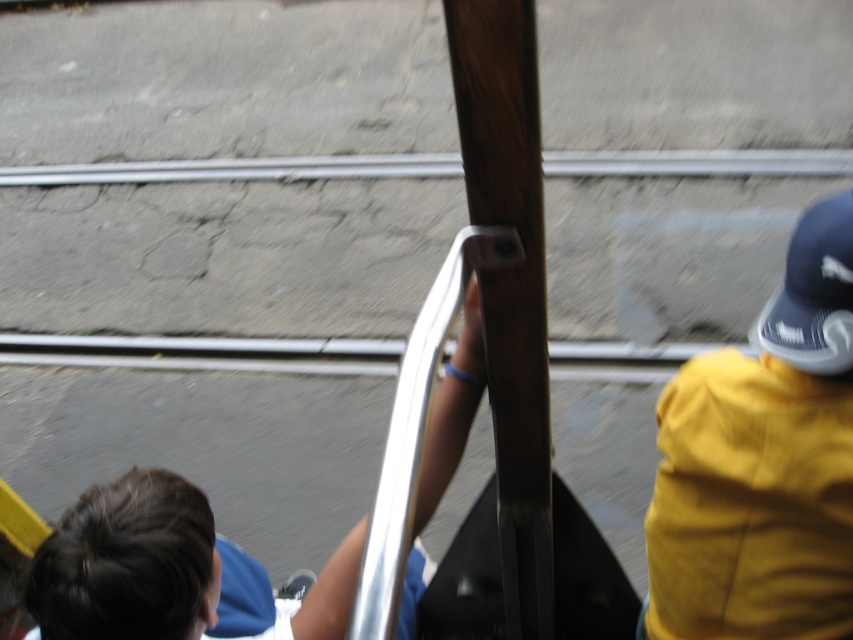
Question: Among these objects, which one is nearest to the camera?

Choices:
 (A) silver metallic rail at upper center
 (B) yellow fabric cap at right

Answer: (B)

Question: Which object appears farthest from the camera in this image?

Choices:
 (A) blue fabric shirt at center
 (B) wooden pole at center
 (C) blue fabric baseball cap at upper right
 (D) yellow fabric cap at right

Answer: (C)

Question: Does blue fabric shirt at center lie in front of wooden pole at center?

Choices:
 (A) yes
 (B) no

Answer: (A)

Question: Based on their relative distances, which object is farther from the wooden pole at center?

Choices:
 (A) yellow fabric cap at right
 (B) silver metallic rail at upper center
 (C) blue fabric shirt at center
 (D) blue fabric baseball cap at upper right

Answer: (B)

Question: Is yellow fabric cap at right below blue fabric baseball cap at upper right?

Choices:
 (A) no
 (B) yes

Answer: (B)

Question: Can you confirm if blue fabric shirt at center is thinner than silver metallic rail at upper center?

Choices:
 (A) yes
 (B) no

Answer: (A)